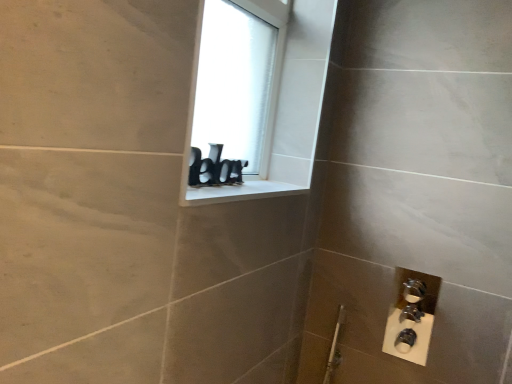
Question: Can you confirm if white matte window screen at upper center is shorter than white glossy window sill at upper center?

Choices:
 (A) yes
 (B) no

Answer: (B)

Question: From a real-world perspective, is white matte window screen at upper center positioned under white glossy window sill at upper center based on gravity?

Choices:
 (A) no
 (B) yes

Answer: (A)

Question: Can we say white matte window screen at upper center lies outside white glossy window sill at upper center?

Choices:
 (A) no
 (B) yes

Answer: (B)

Question: Is white matte window screen at upper center surrounding white glossy window sill at upper center?

Choices:
 (A) yes
 (B) no

Answer: (B)

Question: Can you confirm if white matte window screen at upper center is positioned to the left of white glossy window sill at upper center?

Choices:
 (A) yes
 (B) no

Answer: (A)

Question: Can you confirm if white matte window screen at upper center is taller than white glossy window sill at upper center?

Choices:
 (A) yes
 (B) no

Answer: (A)

Question: Is white glossy window sill at upper center positioned with its back to white matte window screen at upper center?

Choices:
 (A) no
 (B) yes

Answer: (A)

Question: Does white glossy window sill at upper center have a smaller size compared to white matte window screen at upper center?

Choices:
 (A) yes
 (B) no

Answer: (A)

Question: Would you say white glossy window sill at upper center contains white matte window screen at upper center?

Choices:
 (A) no
 (B) yes

Answer: (A)

Question: Is the depth of white glossy window sill at upper center greater than that of white matte window screen at upper center?

Choices:
 (A) yes
 (B) no

Answer: (B)

Question: From a real-world perspective, is white glossy window sill at upper center physically below white matte window screen at upper center?

Choices:
 (A) yes
 (B) no

Answer: (A)

Question: Is white glossy window sill at upper center completely or partially outside of white matte window screen at upper center?

Choices:
 (A) yes
 (B) no

Answer: (A)

Question: Considering the positions of point (233, 79) and point (208, 185), is point (233, 79) closer or farther from the camera than point (208, 185)?

Choices:
 (A) farther
 (B) closer

Answer: (A)